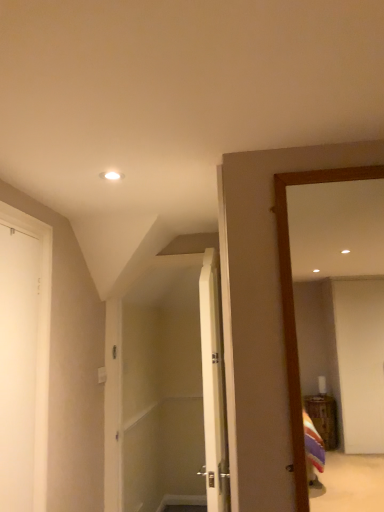
Question: Based on their positions, is white wood door at center, which is the first door in back-to-front order, located to the left or right of wooden mirror at right?

Choices:
 (A) left
 (B) right

Answer: (A)

Question: In terms of size, does white wood door at center, positioned as the second door in left-to-right order, appear bigger or smaller than wooden mirror at right?

Choices:
 (A) big
 (B) small

Answer: (A)

Question: Which is nearer to the wooden mirror at right?

Choices:
 (A) white wood door at center, the 1th door from the right
 (B) white matte door at left, the 1th door viewed from the left

Answer: (A)

Question: Which of these objects is positioned farthest from the wooden mirror at right?

Choices:
 (A) white wood door at center, which is the 2th door from front to back
 (B) white matte door at left, the 1th door viewed from the left

Answer: (B)